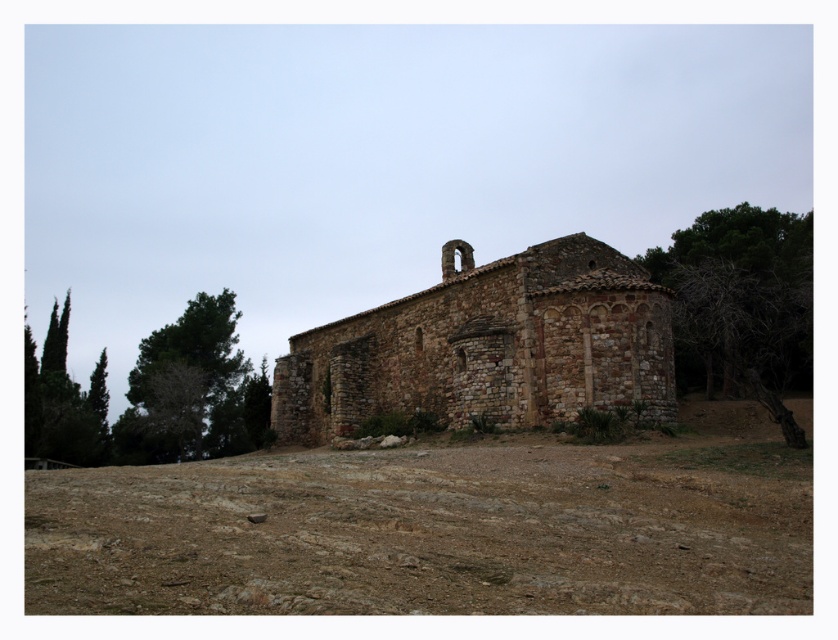
You are standing in front of the brown stone church at center and want to take a photo of the green leafy tree at left. Since the tree is behind the church, will it be visible in the photo?

The brown stone church at center is closer to the viewer than the green leafy tree at left, so the tree will be visible behind the church in the photo.

You are standing at the base of the slope leading to the ancient stone building. You need to place a small garden statue exactly halfway between the brown gravelly dirt at lower center and the bare wood tree at right. Considering their positions, where should you position the statue?

The brown gravelly dirt at lower center is closer to the viewer than the bare wood tree at right, so the statue should be placed closer to the brown gravelly dirt at lower center to be halfway between them.

You are a hiker who has just arrived at the ancient stone building. You notice the brown gravelly dirt at lower center and the bare wood tree at right. Which object is closer to the base of the building?

The brown gravelly dirt at lower center is closer to the base of the building because it is positioned under the bare wood tree at right, meaning the tree is further away from the building compared to the dirt.